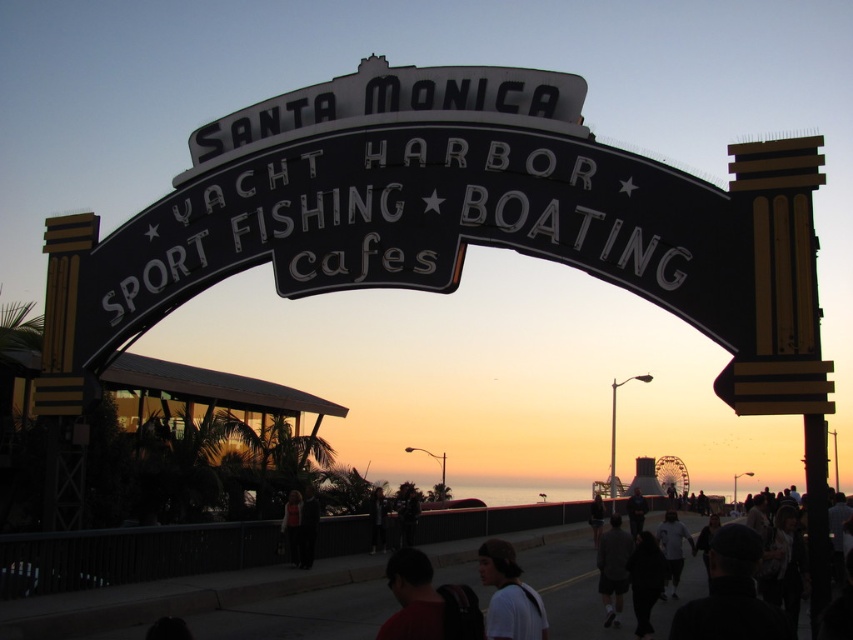
Is white matte shirt at lower center below matte black shirt at center?

Indeed, white matte shirt at lower center is positioned under matte black shirt at center.

Which is in front, point (496, 541) or point (297, 552)?

Point (496, 541) is more forward.

Who is more forward, (502, 628) or (300, 512)?

Point (502, 628)

I want to click on white matte shirt at lower center, so click(x=509, y=595).

Is the position of dark gray shirt at center more distant than that of dark brown leather jacket at lower center?

No, dark gray shirt at center is in front of dark brown leather jacket at lower center.

Is dark gray shirt at center to the right of dark brown leather jacket at lower center from the viewer's perspective?

No, dark gray shirt at center is not to the right of dark brown leather jacket at lower center.

Measure the distance between point (605,624) and camera.

Point (605,624) and camera are 70.16 meters apart.

The width and height of the screenshot is (853, 640). I want to click on dark gray shirt at center, so click(613, 568).

From the picture: Which is above, dark red shirt at lower center or dark gray hoodie at center?

dark gray hoodie at center

Between dark red shirt at lower center and dark gray hoodie at center, which one appears on the left side from the viewer's perspective?

Positioned to the left is dark gray hoodie at center.

Is point (427, 620) positioned before point (386, 515)?

Yes, point (427, 620) is in front of point (386, 515).

Where is `dark red shirt at lower center`? dark red shirt at lower center is located at coordinates (427, 602).